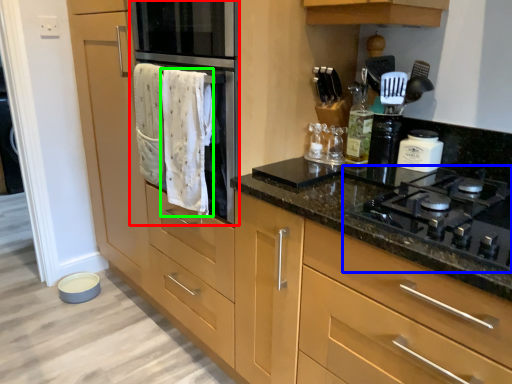
Question: Which object is positioned closest to oven (highlighted by a red box)? Select from gas stove (highlighted by a blue box) and bath towel (highlighted by a green box).

Choices:
 (A) gas stove
 (B) bath towel

Answer: (B)